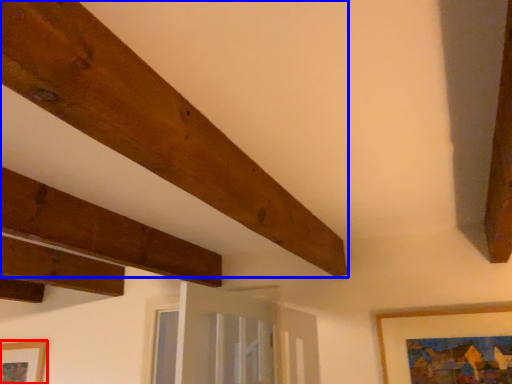
Question: Which of the following is the closest to the observer, picture frame (highlighted by a red box) or plank (highlighted by a blue box)?

Choices:
 (A) picture frame
 (B) plank

Answer: (B)